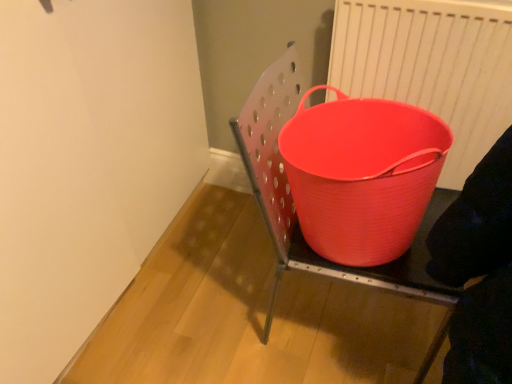
I want to click on free space to the left of matte plastic bucket at center, so click(211, 295).